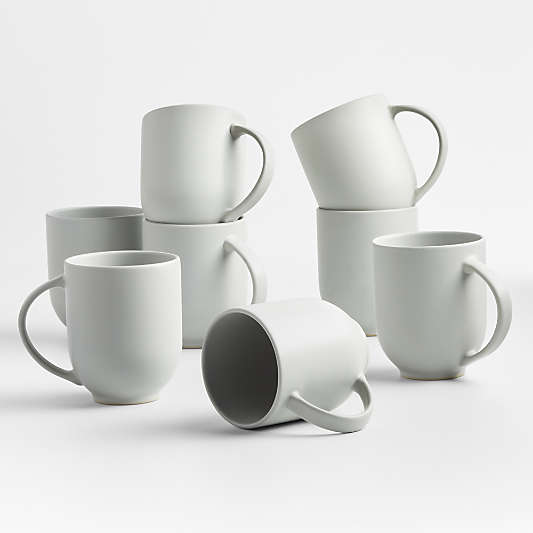
At what (x,y) coordinates should I click in order to perform the action: click on cups that are not stacked. Please return your answer as a coordinate pair (x, y). Looking at the image, I should click on (101, 230), (120, 306), (288, 335), (407, 302).